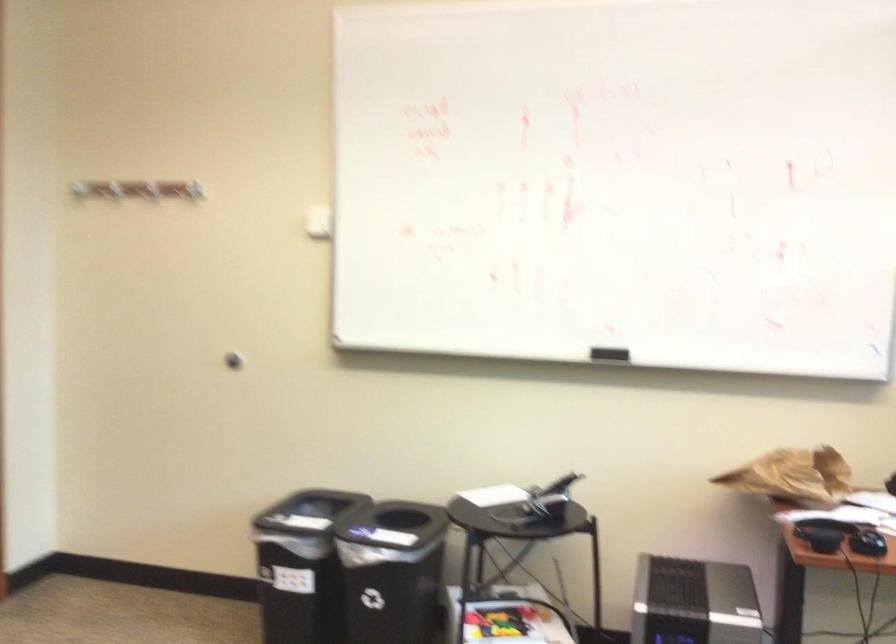
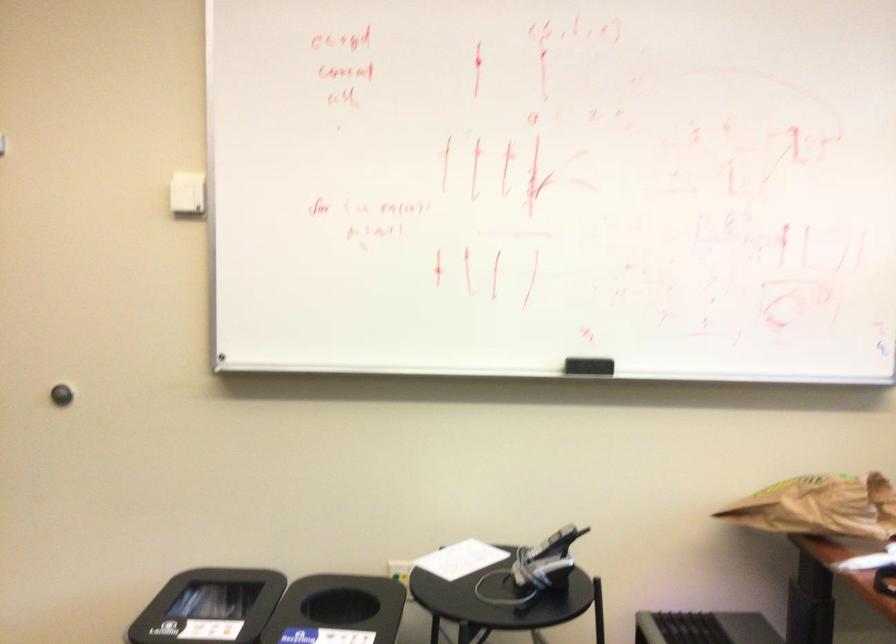
In the second image, find the point that corresponds to point 314,225 in the first image.

(186, 194)